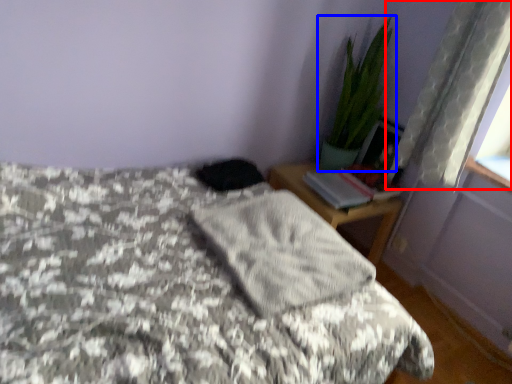
Question: Which of the following is the closest to the observer, curtain (highlighted by a red box) or houseplant (highlighted by a blue box)?

Choices:
 (A) curtain
 (B) houseplant

Answer: (A)